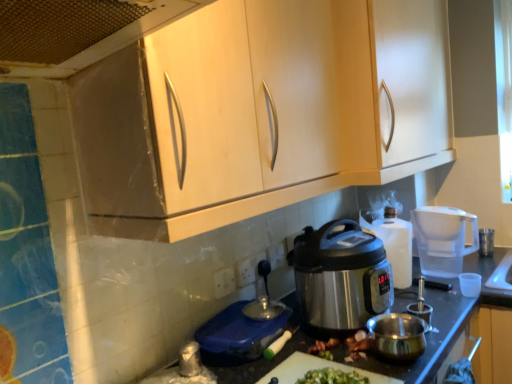
Question: Relative to white plastic power outlet at center, which appears as the 1th power outlet when viewed from the left, is matte wood cabinets at upper center, placed as the 1th cabinetry when sorted from front to back, in front or behind?

Choices:
 (A) front
 (B) behind

Answer: (A)

Question: Is matte wood cabinets at upper center, which is counted as the 2th cabinetry, starting from the back, inside or outside of white plastic power outlet at center, arranged as the third power outlet when viewed from the back?

Choices:
 (A) outside
 (B) inside

Answer: (A)

Question: Which object is the farthest from the metallic mesh at upper left?

Choices:
 (A) satin silver cup at right, which appears as the first appliance when viewed from the right
 (B) satin silver pot at center, which is the 3th appliance from right to left
 (C) white plastic power outlet at center, the second power outlet viewed from the right
 (D) matte wood cabinets at upper center, placed as the 1th cabinetry when sorted from front to back
 (E) blue plastic cutting board at lower center, the 4th appliance viewed from the right

Answer: (A)

Question: Which object is the farthest from the white plastic power outlet at center, marked as the first power outlet in a back-to-front arrangement?

Choices:
 (A) matte wood cabinet at upper center, the 1th cabinetry when ordered from back to front
 (B) satin silver cup at right, which is the fourth appliance in left-to-right order
 (C) blue plastic cutting board at lower center, the 4th appliance when ordered from back to front
 (D) satin silver pot at center, arranged as the third appliance when viewed from the back
 (E) matte wood cabinets at upper center, placed as the 1th cabinetry when sorted from front to back

Answer: (B)